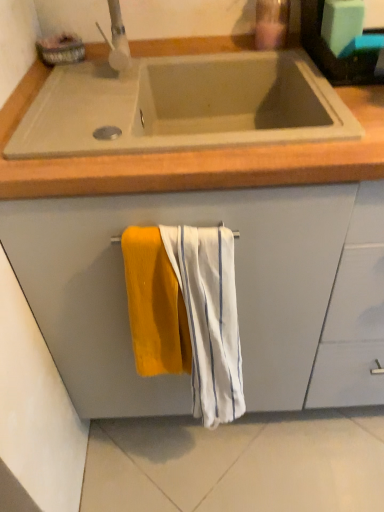
Question: Can you confirm if matte gray cabinet at center is positioned to the left of beige concrete sink at upper center?

Choices:
 (A) yes
 (B) no

Answer: (B)

Question: From the image's perspective, would you say matte gray cabinet at center is positioned over beige concrete sink at upper center?

Choices:
 (A) yes
 (B) no

Answer: (B)

Question: Is matte gray cabinet at center thinner than beige concrete sink at upper center?

Choices:
 (A) no
 (B) yes

Answer: (A)

Question: From the image's perspective, is matte gray cabinet at center located beneath beige concrete sink at upper center?

Choices:
 (A) no
 (B) yes

Answer: (B)

Question: Can you confirm if matte gray cabinet at center is wider than beige concrete sink at upper center?

Choices:
 (A) no
 (B) yes

Answer: (B)

Question: Is point coord(273,35) closer or farther from the camera than point coord(51,293)?

Choices:
 (A) closer
 (B) farther

Answer: (B)

Question: Is translucent plastic soap dispenser at upper center spatially inside matte gray cabinet at center, or outside of it?

Choices:
 (A) outside
 (B) inside

Answer: (A)

Question: In terms of width, does translucent plastic soap dispenser at upper center look wider or thinner when compared to matte gray cabinet at center?

Choices:
 (A) thin
 (B) wide

Answer: (A)

Question: Based on their sizes in the image, would you say translucent plastic soap dispenser at upper center is bigger or smaller than matte gray cabinet at center?

Choices:
 (A) big
 (B) small

Answer: (B)

Question: Considering the positions of beige concrete sink at upper center and matte gray cabinet at center in the image, is beige concrete sink at upper center taller or shorter than matte gray cabinet at center?

Choices:
 (A) tall
 (B) short

Answer: (B)

Question: Is beige concrete sink at upper center in front of or behind matte gray cabinet at center in the image?

Choices:
 (A) front
 (B) behind

Answer: (B)

Question: From a real-world perspective, is beige concrete sink at upper center above or below matte gray cabinet at center?

Choices:
 (A) above
 (B) below

Answer: (A)

Question: Is beige concrete sink at upper center to the left or to the right of matte gray cabinet at center in the image?

Choices:
 (A) left
 (B) right

Answer: (A)

Question: In the image, is beige concrete sink at upper center positioned in front of or behind white textured towel at center, the second beach towel when ordered from left to right?

Choices:
 (A) behind
 (B) front

Answer: (A)

Question: From a real-world perspective, is beige concrete sink at upper center physically located above or below white textured towel at center, the second beach towel when ordered from left to right?

Choices:
 (A) above
 (B) below

Answer: (A)